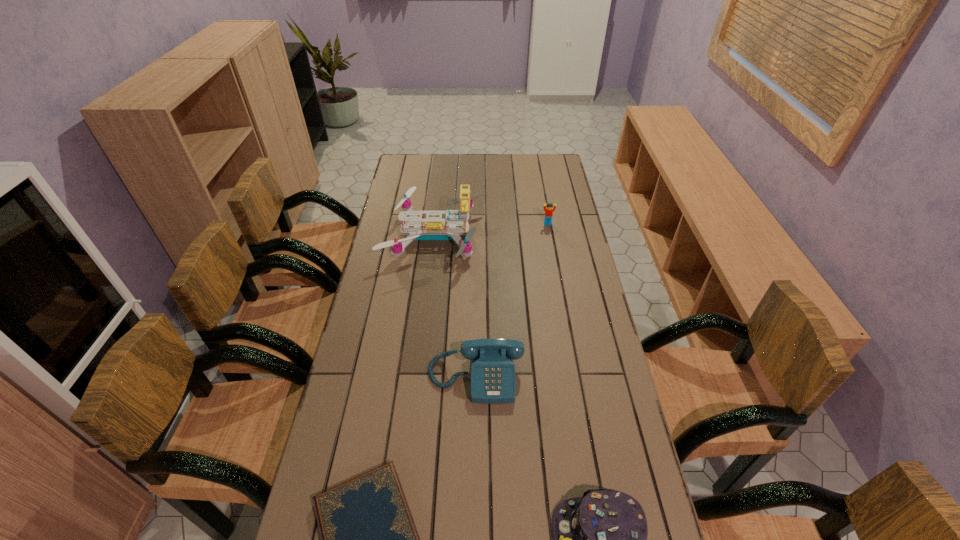
This screenshot has width=960, height=540. Find the location of `the tallest object`. the tallest object is located at coordinates (432, 228).

I want to click on the third farthest object, so click(x=493, y=381).

The width and height of the screenshot is (960, 540). What are the coordinates of `Lego` in the screenshot? It's located at (549, 210).

At what (x,y) coordinates should I click in order to perform the action: click on vacant space located on the front-facing side of the drone. Please return your answer as a coordinate pair (x, y). Looking at the image, I should click on (576, 236).

Locate an element on the screen. This screenshot has height=540, width=960. vacant area situated 0.160m on the dial of the telephone is located at coordinates (475, 463).

Image resolution: width=960 pixels, height=540 pixels. Identify the location of vacant space situated on the face of the Lego. (556, 267).

The height and width of the screenshot is (540, 960). In order to click on object that is at the left edge in this screenshot , I will do `click(432, 228)`.

The height and width of the screenshot is (540, 960). I want to click on object located in the right edge section of the desktop, so click(549, 210).

The image size is (960, 540). Identify the location of vacant space at the left edge of the desktop. (382, 278).

Find the location of `free region at the right edge of the desktop`. free region at the right edge of the desktop is located at coordinates (556, 202).